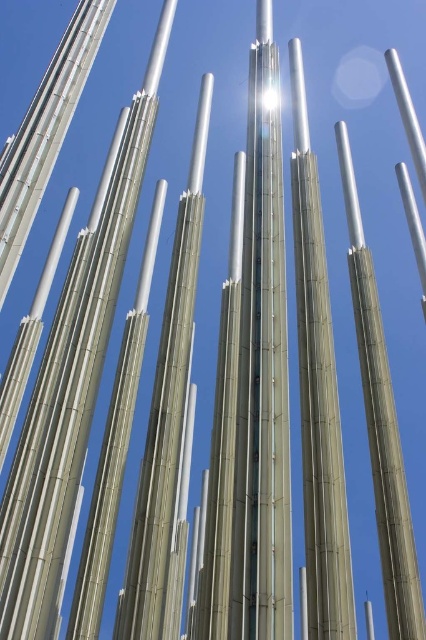
Question: Can you confirm if metallic bamboo tower at center is wider than satin silver pole at center?

Choices:
 (A) no
 (B) yes

Answer: (B)

Question: Can you confirm if shiny metallic tower at center is smaller than silver bamboo pole at center?

Choices:
 (A) yes
 (B) no

Answer: (B)

Question: Estimate the real-world distances between objects in this image. Which object is farther from the metallic bamboo tower at center?

Choices:
 (A) silver bamboo pole at center
 (B) shiny metallic tower at center
 (C) satin silver pole at center

Answer: (A)

Question: Based on their relative distances, which object is farther from the shiny metallic tower at center?

Choices:
 (A) metallic bamboo tower at center
 (B) silver bamboo pole at center
 (C) brushed metal pole at center
 (D) satin silver pole at center

Answer: (D)

Question: Is metallic bamboo tower at center positioned before silver bamboo pole at center?

Choices:
 (A) no
 (B) yes

Answer: (B)

Question: Which point is farther to the camera?

Choices:
 (A) shiny metallic tower at center
 (B) silver bamboo pole at center

Answer: (B)